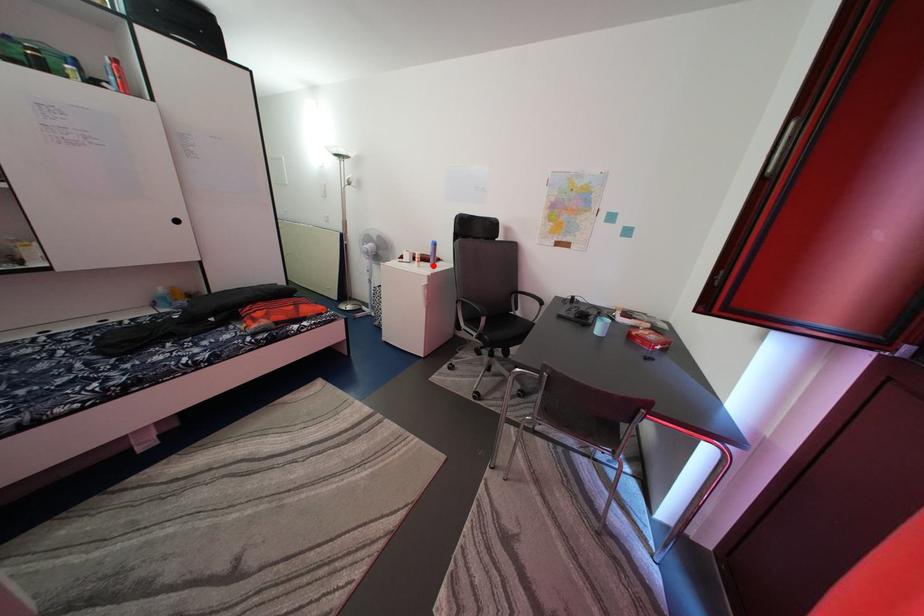
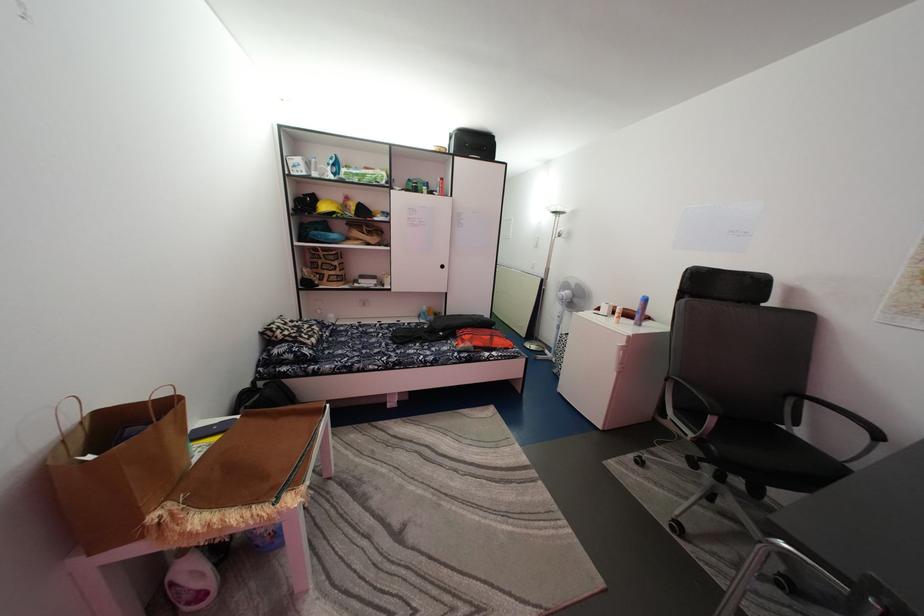
Locate, in the second image, the point that corresponds to the highlighted location in the first image.

(637, 322)